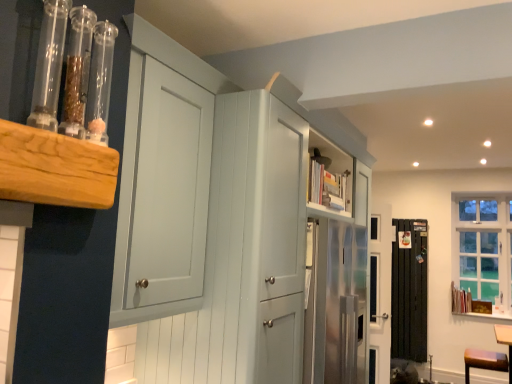
Question: From their relative heights in the image, would you say clear glass window at upper right is taller or shorter than brown wood vanity at lower right?

Choices:
 (A) tall
 (B) short

Answer: (A)

Question: Considering the positions of point (501, 241) and point (487, 362), is point (501, 241) closer or farther from the camera than point (487, 362)?

Choices:
 (A) closer
 (B) farther

Answer: (B)

Question: Estimate the real-world distances between objects in this image. Which object is closer to the black metal radiator at lower right?

Choices:
 (A) clear glass window at upper right
 (B) matte white cabinet at upper center
 (C) brown wood vanity at lower right
 (D) transparent glass tubes at upper left

Answer: (A)

Question: Estimate the real-world distances between objects in this image. Which object is farther from the transparent glass tubes at upper left?

Choices:
 (A) black metal radiator at lower right
 (B) clear glass window at upper right
 (C) brown wood vanity at lower right
 (D) matte white cabinet at upper center

Answer: (B)